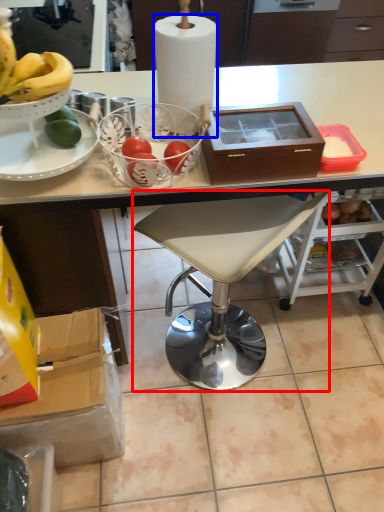
Question: Which object is further to the camera taking this photo, chair (highlighted by a red box) or paper towel (highlighted by a blue box)?

Choices:
 (A) chair
 (B) paper towel

Answer: (A)